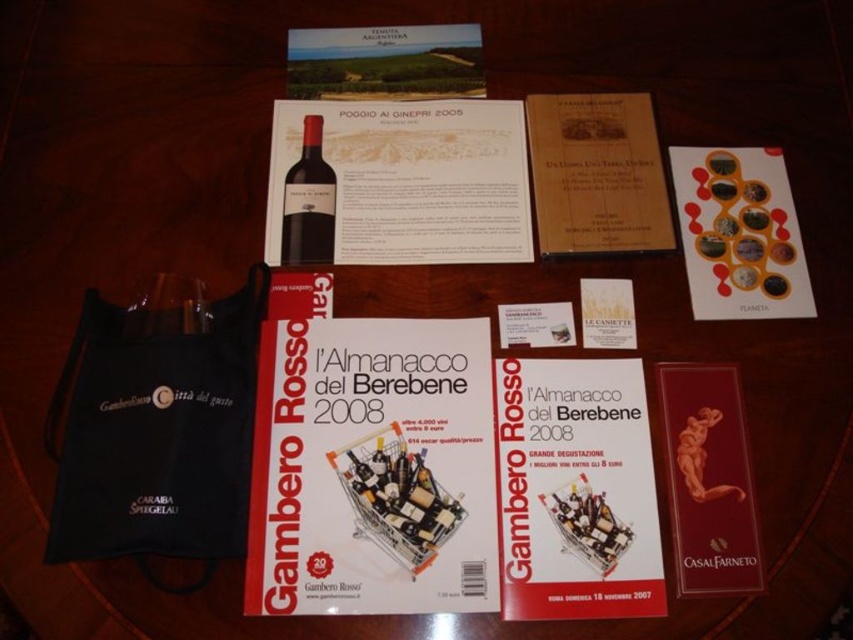
You are standing at the edge of the wooden table where the items are laid out. You want to reach the matte paper wine at upper center to read its label. Considering your arm can comfortably extend 28 inches, will you be able to comfortably reach it?

The matte paper wine at upper center is 31.19 inches away from the viewer. Since your arm can only extend 28 inches, you will not be able to comfortably reach it without moving closer.

You are organizing a wine tasting event and need to place the white paper at center and the matte paper menu at upper center on a shelf. Which one should you place first to ensure they both fit vertically?

The white paper at center is much taller than the matte paper menu at upper center, so you should place the white paper at center first to accommodate its height.